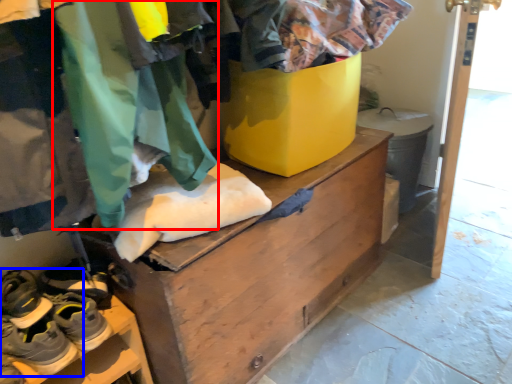
Question: Which object is further to the camera taking this photo, clothing (highlighted by a red box) or footwear (highlighted by a blue box)?

Choices:
 (A) clothing
 (B) footwear

Answer: (B)